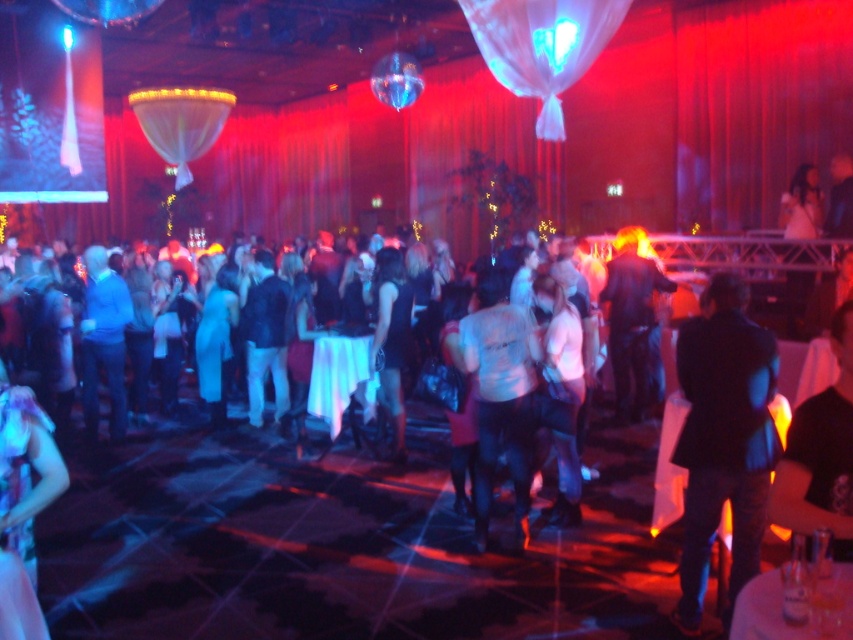
Is point (747, 332) closer to viewer compared to point (20, 611)?

No, (747, 332) is further to viewer.

The height and width of the screenshot is (640, 853). I want to click on black leather jacket at center, so click(723, 440).

Which of these two, white matte shirt at center or black matte shirt at center, stands taller?

With more height is white matte shirt at center.

Image resolution: width=853 pixels, height=640 pixels. Describe the element at coordinates (500, 396) in the screenshot. I see `white matte shirt at center` at that location.

I want to click on white matte shirt at center, so click(x=500, y=396).

Which is above, black matte shirt at center or shiny purple dress at lower left?

Positioned higher is black matte shirt at center.

Who is more forward, [798,518] or [61,458]?

Point [798,518]

Image resolution: width=853 pixels, height=640 pixels. I want to click on black matte shirt at center, so click(x=820, y=454).